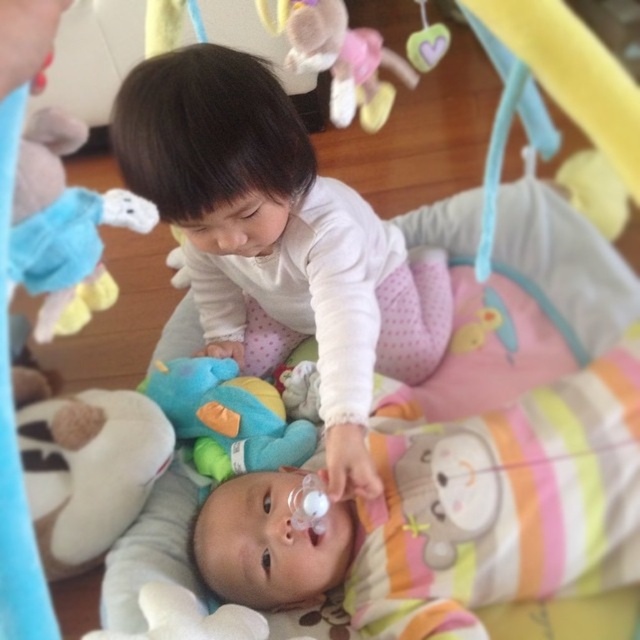
Question: Does smooth white toddler at center appear on the left side of white plush toy at lower left?

Choices:
 (A) yes
 (B) no

Answer: (B)

Question: Which object is the closest to the white plush toy at lower left?

Choices:
 (A) smooth white toddler at center
 (B) soft plush toy at center

Answer: (B)

Question: Which point is farther to the camera?

Choices:
 (A) white plush toy at lower left
 (B) smooth white toddler at center

Answer: (A)

Question: Which object is the closest to the soft plush elephant at upper left?

Choices:
 (A) smooth white toddler at center
 (B) white plush toy at lower left

Answer: (A)

Question: Can you confirm if smooth white toddler at center is positioned to the right of soft plush elephant at upper left?

Choices:
 (A) yes
 (B) no

Answer: (A)

Question: Can you confirm if smooth white toddler at center is positioned above soft plush elephant at upper left?

Choices:
 (A) yes
 (B) no

Answer: (A)